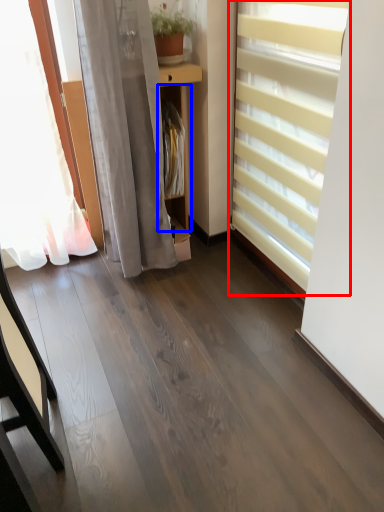
Question: Which of the following is the closest to the observer, window blind (highlighted by a red box) or shelf (highlighted by a blue box)?

Choices:
 (A) window blind
 (B) shelf

Answer: (A)